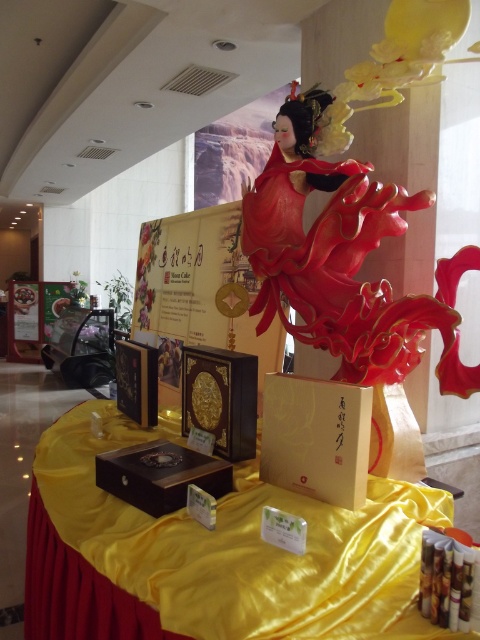
What do you see at coordinates (343, 273) in the screenshot?
I see `glossy red dress at center` at bounding box center [343, 273].

Where is `glossy red dress at center`? glossy red dress at center is located at coordinates (343, 273).

The width and height of the screenshot is (480, 640). Identify the location of glossy red dress at center. (343, 273).

Can you confirm if matte gold cardboard box at center is positioned to the left of wooden box at center?

No, matte gold cardboard box at center is not to the left of wooden box at center.

Who is shorter, matte gold cardboard box at center or wooden box at center?

With less height is wooden box at center.

The image size is (480, 640). I want to click on matte gold cardboard box at center, so click(x=315, y=436).

Between yellow satin table at center and glossy red dress at center, which one appears on the right side from the viewer's perspective?

glossy red dress at center is more to the right.

Where is `yellow satin table at center`? yellow satin table at center is located at coordinates (239, 548).

Who is more distant from viewer, (x=48, y=448) or (x=364, y=252)?

Point (x=48, y=448)

What are the coordinates of `yellow satin table at center` in the screenshot? It's located at (239, 548).